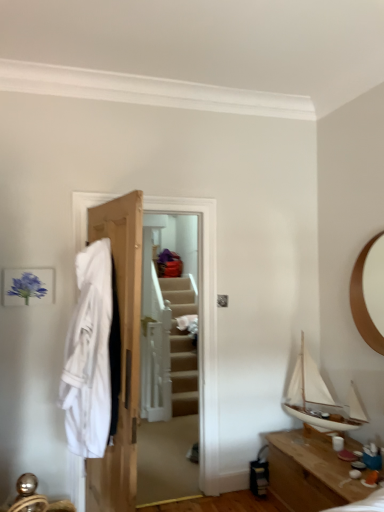
Question: Is wooden table at lower right taller or shorter than white matte sailboat at right?

Choices:
 (A) short
 (B) tall

Answer: (A)

Question: Would you say wooden table at lower right is inside or outside white matte sailboat at right?

Choices:
 (A) outside
 (B) inside

Answer: (A)

Question: Estimate the real-world distances between objects in this image. Which object is closer to the white matte sailboat at right?

Choices:
 (A) wooden door at center
 (B) wooden table at lower right
 (C) white cotton robe at left

Answer: (B)

Question: Which of these objects is positioned closest to the white cotton robe at left?

Choices:
 (A) wooden door at center
 (B) white matte sailboat at right
 (C) wooden table at lower right

Answer: (A)